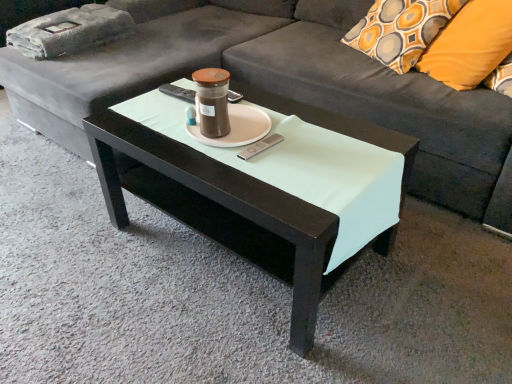
Question: Is orange fabric pillow at upper right further to the viewer compared to matte black coffee table at center?

Choices:
 (A) no
 (B) yes

Answer: (B)

Question: Does orange fabric pillow at upper right appear on the right side of matte black coffee table at center?

Choices:
 (A) yes
 (B) no

Answer: (A)

Question: Is orange fabric pillow at upper right positioned before matte black coffee table at center?

Choices:
 (A) yes
 (B) no

Answer: (B)

Question: Can we say orange fabric pillow at upper right lies outside matte black coffee table at center?

Choices:
 (A) no
 (B) yes

Answer: (B)

Question: Does orange fabric pillow at upper right appear on the left side of matte black coffee table at center?

Choices:
 (A) yes
 (B) no

Answer: (B)

Question: Based on their positions, is dark gray fabric couch at center located to the left or right of matte black coffee table at center?

Choices:
 (A) right
 (B) left

Answer: (A)

Question: From a real-world perspective, relative to matte black coffee table at center, is dark gray fabric couch at center vertically above or below?

Choices:
 (A) below
 (B) above

Answer: (B)

Question: From the image's perspective, is dark gray fabric couch at center positioned above or below matte black coffee table at center?

Choices:
 (A) above
 (B) below

Answer: (A)

Question: Considering the positions of point (436, 102) and point (303, 264), is point (436, 102) closer or farther from the camera than point (303, 264)?

Choices:
 (A) closer
 (B) farther

Answer: (B)

Question: In terms of height, does dark gray fabric couch at center look taller or shorter compared to matte brown glass candle holder at center?

Choices:
 (A) short
 (B) tall

Answer: (B)

Question: Considering their positions, is dark gray fabric couch at center located in front of or behind matte brown glass candle holder at center?

Choices:
 (A) behind
 (B) front

Answer: (B)

Question: From the image's perspective, relative to matte brown glass candle holder at center, is dark gray fabric couch at center above or below?

Choices:
 (A) above
 (B) below

Answer: (A)

Question: Would you say dark gray fabric couch at center is inside or outside matte brown glass candle holder at center?

Choices:
 (A) outside
 (B) inside

Answer: (A)

Question: Based on their positions, is orange fabric pillow at upper right located to the left or right of dark gray fabric couch at center?

Choices:
 (A) left
 (B) right

Answer: (B)

Question: Do you think orange fabric pillow at upper right is within dark gray fabric couch at center, or outside of it?

Choices:
 (A) outside
 (B) inside

Answer: (B)